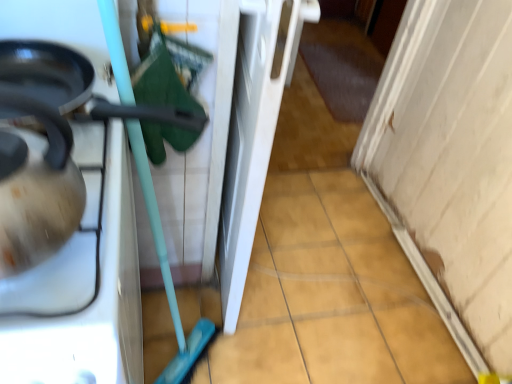
The image size is (512, 384). Find the location of `shiny black frying pan at left`. shiny black frying pan at left is located at coordinates (47, 72).

At what (x,y) coordinates should I click in order to perform the action: click on matte white tea pot at left. Please return your answer as a coordinate pair (x, y). Looking at the image, I should click on (37, 190).

Which is less distant, (85, 193) or (108, 304)?

Point (85, 193) appears to be farther away from the viewer than point (108, 304).

Between matte white tea pot at left and matte black kettle at left, which one has larger width?

Wider between the two is matte black kettle at left.

How different are the orientations of matte white tea pot at left and matte black kettle at left in degrees?

There is a 0.459-degree angle between the facing directions of matte white tea pot at left and matte black kettle at left.

Measure the distance between matte white tea pot at left and matte black kettle at left.

7.06 inches.

Is matte black kettle at left next to matte white tea pot at left and touching it?

They are not placed beside each other.

Is matte black kettle at left looking in the opposite direction of matte white tea pot at left?

No, matte black kettle at left is not facing away from matte white tea pot at left.

Is point (124, 210) more distant than point (54, 144)?

Yes.

Which of these two, matte black kettle at left or matte white tea pot at left, is wider?

Wider between the two is matte black kettle at left.

From the image's perspective, would you say matte white tea pot at left is positioned over shiny black frying pan at left?

No, from the image's perspective, matte white tea pot at left is not on top of shiny black frying pan at left.

How different are the orientations of matte white tea pot at left and shiny black frying pan at left in degrees?

There is a 3.81-degree angle between the facing directions of matte white tea pot at left and shiny black frying pan at left.

Who is taller, matte white tea pot at left or shiny black frying pan at left?

matte white tea pot at left is taller.

Does matte white tea pot at left appear on the right side of shiny black frying pan at left?

No, matte white tea pot at left is not to the right of shiny black frying pan at left.

In the scene shown: Would you consider shiny black frying pan at left to be distant from matte white tea pot at left?

That's not correct — shiny black frying pan at left is a little close to matte white tea pot at left.

Is shiny black frying pan at left completely or partially outside of matte white tea pot at left?

Yes, shiny black frying pan at left is outside of matte white tea pot at left.

From the image's perspective, is shiny black frying pan at left positioned above or below matte white tea pot at left?

shiny black frying pan at left is situated higher than matte white tea pot at left in the image.

Is shiny black frying pan at left taller than matte white tea pot at left?

No.

Considering the relative positions of shiny black frying pan at left and matte black kettle at left in the image provided, is shiny black frying pan at left to the left of matte black kettle at left from the viewer's perspective?

Incorrect, shiny black frying pan at left is not on the left side of matte black kettle at left.

Does shiny black frying pan at left lie behind matte black kettle at left?

Yes, the depth of shiny black frying pan at left is greater than that of matte black kettle at left.

From the image's perspective, is shiny black frying pan at left above matte black kettle at left?

Yes.

Can you tell me how much shiny black frying pan at left and matte black kettle at left differ in facing direction?

The angle between the facing direction of shiny black frying pan at left and the facing direction of matte black kettle at left is 4.27 degrees.

Does point (120, 167) come farther from viewer compared to point (62, 99)?

No, (120, 167) is in front of (62, 99).

Considering the relative positions of matte black kettle at left and shiny black frying pan at left in the image provided, is matte black kettle at left to the right of shiny black frying pan at left from the viewer's perspective?

No.

Would you consider matte black kettle at left to be distant from shiny black frying pan at left?

matte black kettle at left is near shiny black frying pan at left, not far away.

Which object is further away from the camera, matte black kettle at left or shiny black frying pan at left?

shiny black frying pan at left is further from the camera.

In order to click on tea pot in front of the matte black kettle at left in this screenshot , I will do point(37,190).

Locate an element on the screen. home appliance lying on the left of matte white tea pot at left is located at coordinates (82, 282).

Looking at the image, which one is located further to shiny black frying pan at left, matte black kettle at left or matte white tea pot at left?

matte white tea pot at left is further to shiny black frying pan at left.

From the image, which object appears to be farther from shiny black frying pan at left, matte white tea pot at left or matte black kettle at left?

Among the two, matte white tea pot at left is located further to shiny black frying pan at left.

Estimate the real-world distances between objects in this image. Which object is further from matte white tea pot at left, matte black kettle at left or shiny black frying pan at left?

shiny black frying pan at left lies further to matte white tea pot at left than the other object.

From the image, which object appears to be farther from matte black kettle at left, shiny black frying pan at left or matte white tea pot at left?

Result: matte white tea pot at left is further to matte black kettle at left.

Estimate the real-world distances between objects in this image. Which object is closer to matte black kettle at left, matte white tea pot at left or shiny black frying pan at left?

The object closer to matte black kettle at left is shiny black frying pan at left.

Considering their positions, is shiny black frying pan at left positioned further to matte white tea pot at left than matte black kettle at left?

shiny black frying pan at left is further to matte white tea pot at left.

The width and height of the screenshot is (512, 384). Find the location of `home appliance between matte white tea pot at left and shiny black frying pan at left along the z-axis`. home appliance between matte white tea pot at left and shiny black frying pan at left along the z-axis is located at coordinates (82, 282).